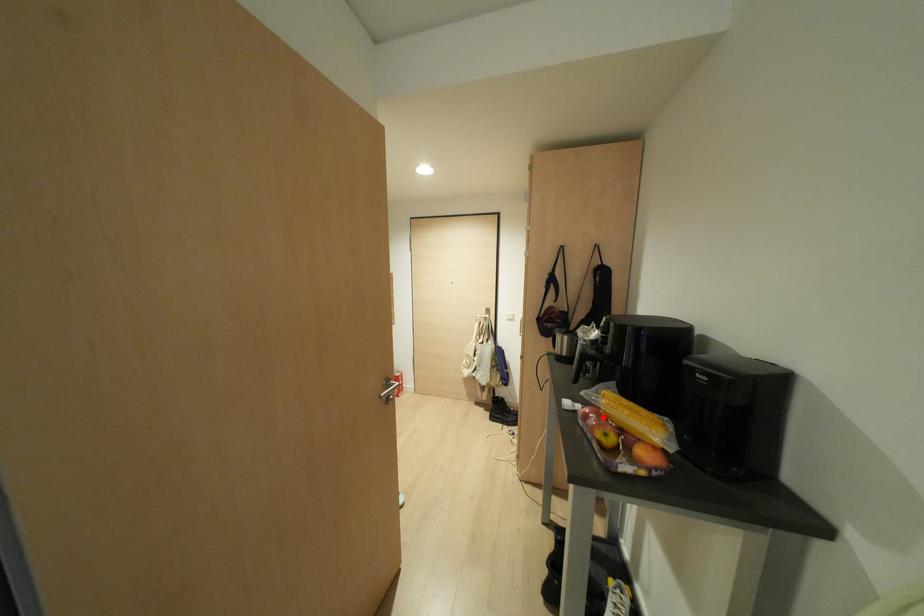
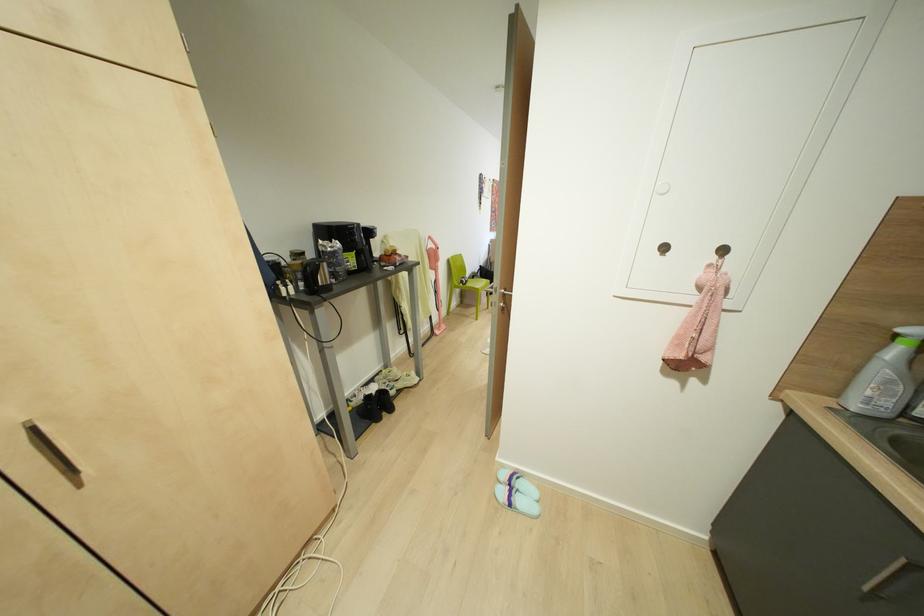
Question: I am providing you with two images of the same scene from different viewpoints. A red point is marked on the first image. Is the red point's position out of view in image 2?

Choices:
 (A) Yes
 (B) No

Answer: (A)